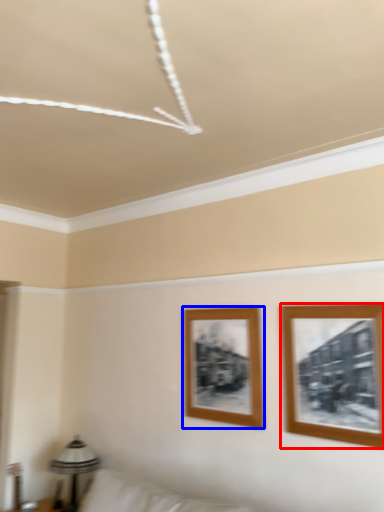
Question: Among these objects, which one is farthest to the camera, picture frame (highlighted by a red box) or picture frame (highlighted by a blue box)?

Choices:
 (A) picture frame
 (B) picture frame

Answer: (B)